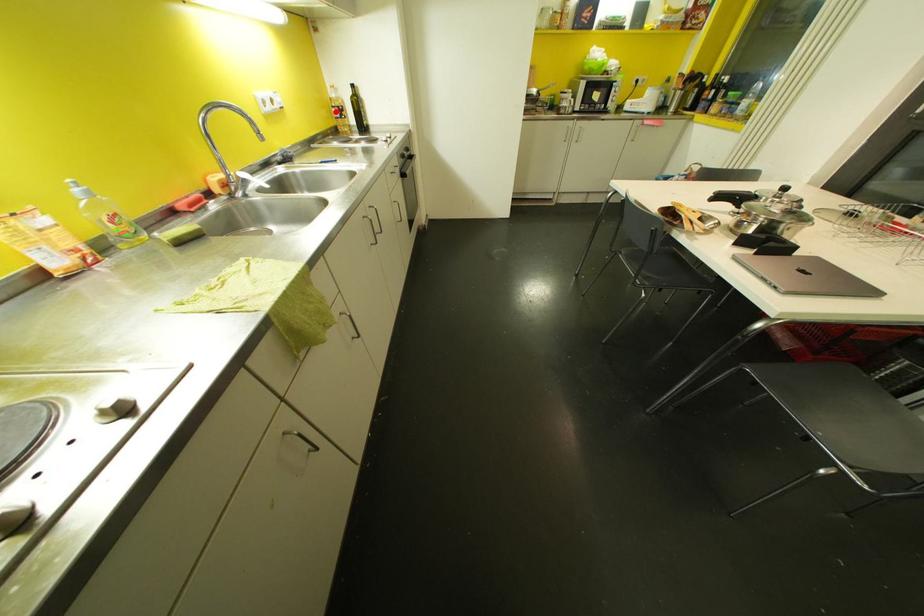
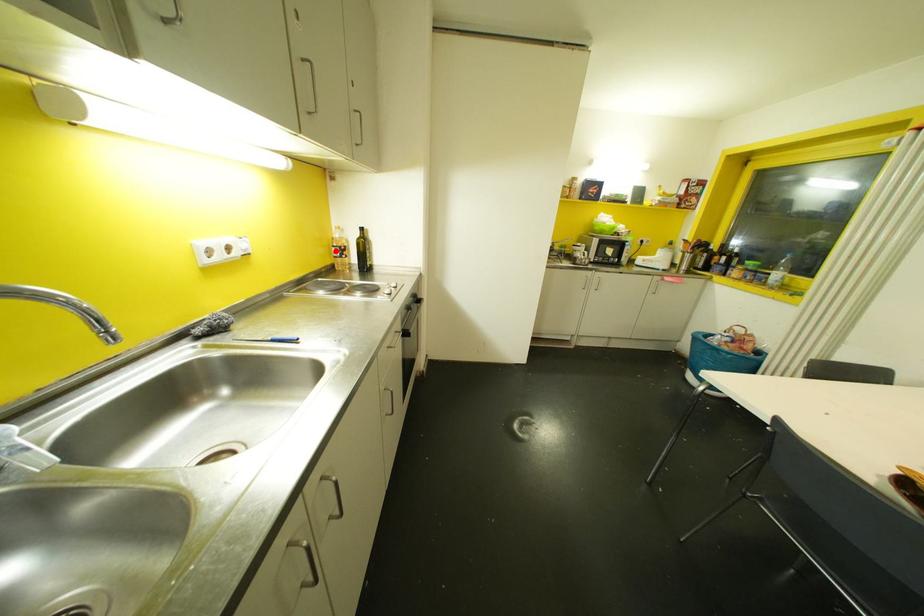
I am providing you with two images of the same scene from different viewpoints. A red point is marked on the first image and another point is marked on the second image. Do the highlighted points in image1 and image2 indicate the same real-world spot?

Yes